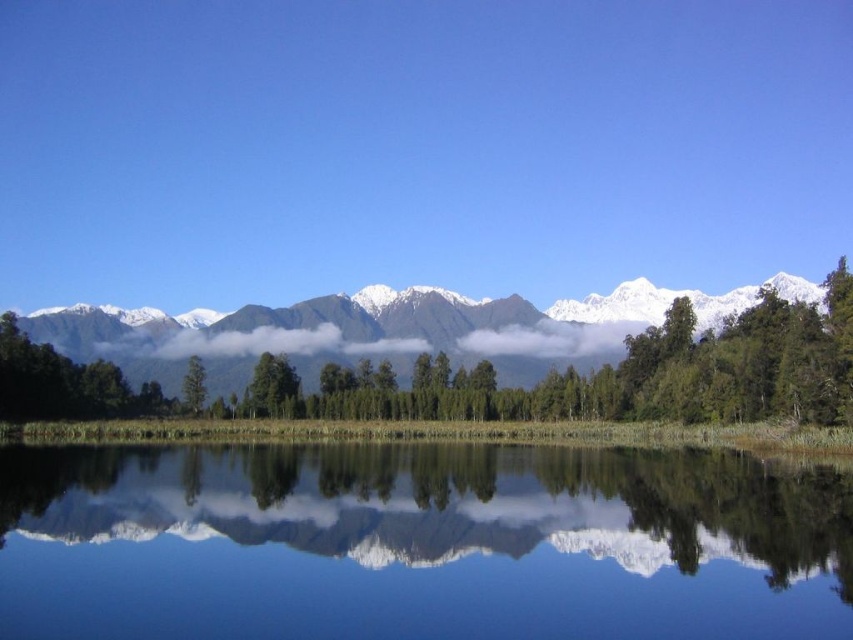
You are an artist trying to paint this scene. You want to ensure the snowy mountain range at center and the white fluffy cloud at center are proportionally accurate. Which object should you paint larger?

The snowy mountain range at center should be painted larger than the white fluffy cloud at center because the snowy mountain range at center is bigger than the white fluffy cloud at center according to the description.

You are standing at the edge of the lake and see the point at coordinates (x=252, y=342). Based on the scene description, where is this point located?

The point at coordinates (x=252, y=342) is located on the white fluffy cloud at center.